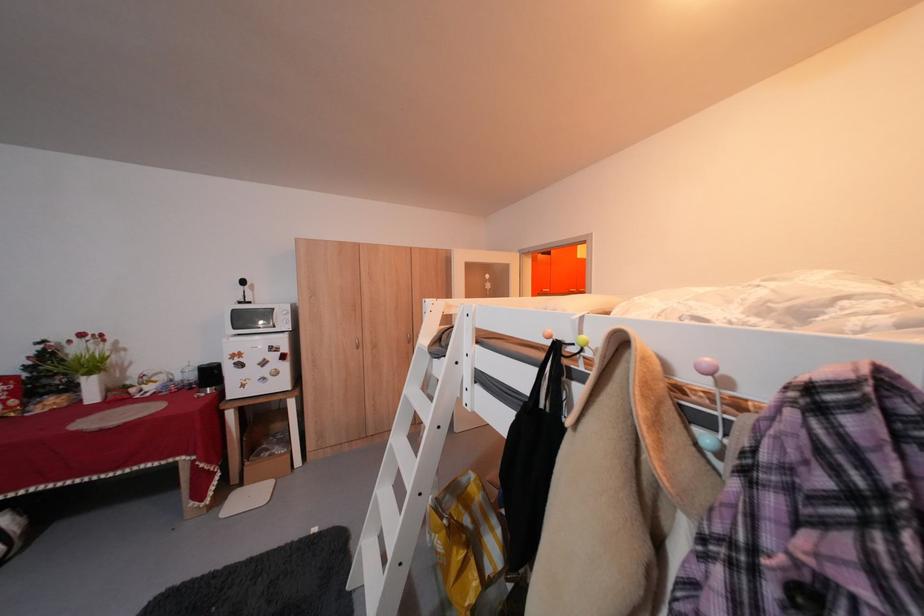
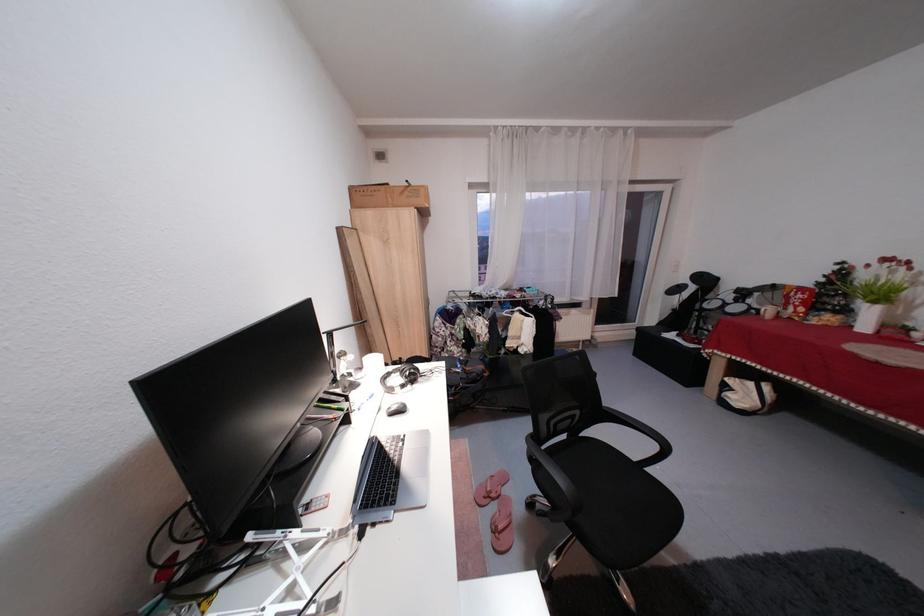
The point at [104,400] is marked in the first image. Where is the corresponding point in the second image?

(877, 330)